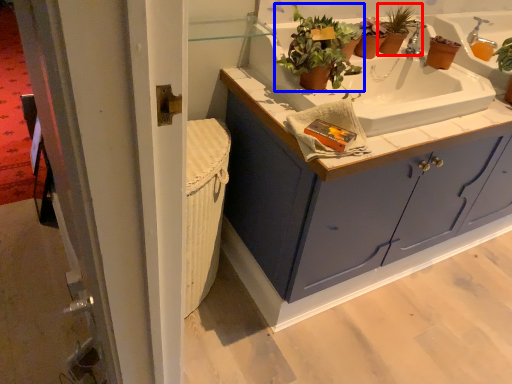
Question: Which point is further to the camera, houseplant (highlighted by a red box) or houseplant (highlighted by a blue box)?

Choices:
 (A) houseplant
 (B) houseplant

Answer: (A)